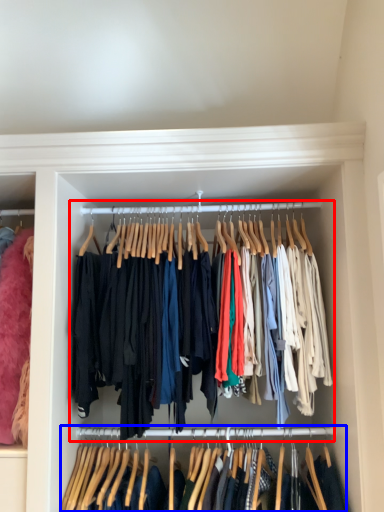
Question: Which of the following is the farthest to the observer, closet (highlighted by a red box) or closet (highlighted by a blue box)?

Choices:
 (A) closet
 (B) closet

Answer: (A)